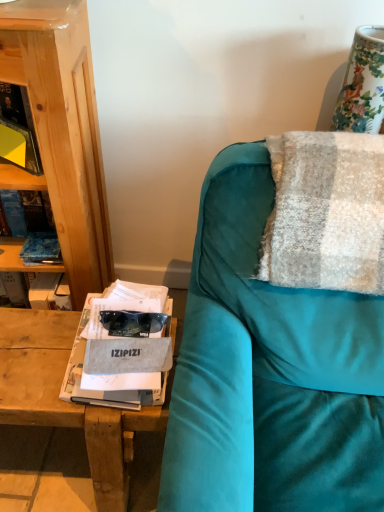
Question: Are gray fabric magazine at left and porcelain floral vase at upper right making contact?

Choices:
 (A) no
 (B) yes

Answer: (A)

Question: From a real-world perspective, does gray fabric magazine at left sit lower than porcelain floral vase at upper right?

Choices:
 (A) no
 (B) yes

Answer: (B)

Question: Would you say gray fabric magazine at left is a long distance from porcelain floral vase at upper right?

Choices:
 (A) yes
 (B) no

Answer: (B)

Question: Considering the relative sizes of gray fabric magazine at left and porcelain floral vase at upper right in the image provided, is gray fabric magazine at left taller than porcelain floral vase at upper right?

Choices:
 (A) no
 (B) yes

Answer: (A)

Question: From the image's perspective, is gray fabric magazine at left under porcelain floral vase at upper right?

Choices:
 (A) yes
 (B) no

Answer: (A)

Question: From a real-world perspective, is textured woolen blanket at right positioned above or below gray fabric magazine at left?

Choices:
 (A) below
 (B) above

Answer: (B)

Question: Considering their positions, is textured woolen blanket at right located in front of or behind gray fabric magazine at left?

Choices:
 (A) front
 (B) behind

Answer: (A)

Question: Does point (302, 240) appear closer or farther from the camera than point (155, 390)?

Choices:
 (A) closer
 (B) farther

Answer: (A)

Question: Considering the positions of textured woolen blanket at right and gray fabric magazine at left in the image, is textured woolen blanket at right taller or shorter than gray fabric magazine at left?

Choices:
 (A) short
 (B) tall

Answer: (B)

Question: From a real-world perspective, relative to gray fabric magazine at left, is porcelain floral vase at upper right vertically above or below?

Choices:
 (A) above
 (B) below

Answer: (A)

Question: Is point 344,87 positioned closer to the camera than point 77,390?

Choices:
 (A) closer
 (B) farther

Answer: (B)

Question: From the image's perspective, relative to gray fabric magazine at left, is porcelain floral vase at upper right above or below?

Choices:
 (A) below
 (B) above

Answer: (B)

Question: From their relative heights in the image, would you say porcelain floral vase at upper right is taller or shorter than gray fabric magazine at left?

Choices:
 (A) tall
 (B) short

Answer: (A)

Question: Is gray fabric magazine at left taller or shorter than porcelain floral vase at upper right?

Choices:
 (A) tall
 (B) short

Answer: (B)

Question: From a real-world perspective, is gray fabric magazine at left above or below porcelain floral vase at upper right?

Choices:
 (A) below
 (B) above

Answer: (A)